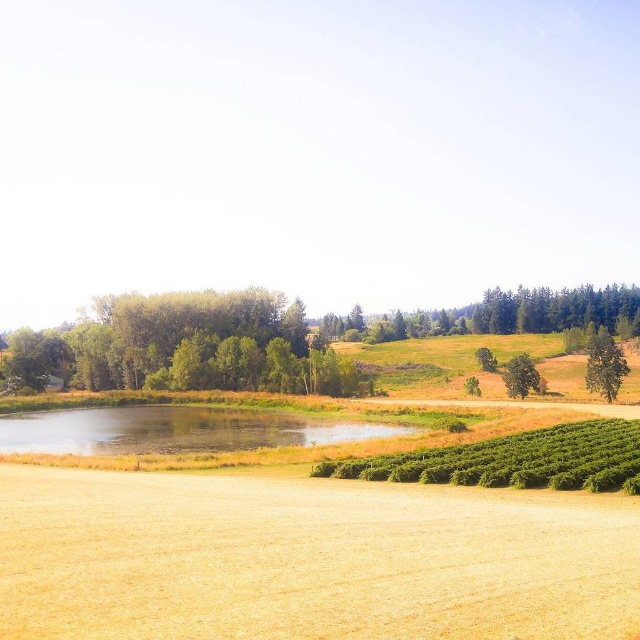
Can you confirm if green leafy trees at left is wider than green textured tree at center?

No.

In the scene shown: Which is more to the left, green leafy trees at left or green textured tree at center?

green leafy trees at left is more to the left.

Which is behind, point (140, 305) or point (604, 307)?

The point (604, 307) is more distant.

The width and height of the screenshot is (640, 640). In order to click on green leafy trees at left in this screenshot , I will do click(192, 346).

Who is taller, golden dry wheat field at lower center or green leafy tree at right?

Standing taller between the two is green leafy tree at right.

Can you confirm if golden dry wheat field at lower center is thinner than green leafy tree at right?

Correct, golden dry wheat field at lower center's width is less than green leafy tree at right's.

Does point (563, 522) lie behind point (592, 356)?

No, (563, 522) is closer to viewer.

The width and height of the screenshot is (640, 640). Identify the location of golden dry wheat field at lower center. (307, 560).

Between green leafy hedge at lower right and green leafy tree at center-right, which one appears on the left side from the viewer's perspective?

From the viewer's perspective, green leafy hedge at lower right appears more on the left side.

Between point (531, 481) and point (502, 378), which one is positioned in front?

Positioned in front is point (531, 481).

Describe the element at coordinates (515, 460) in the screenshot. The image size is (640, 640). I see `green leafy hedge at lower right` at that location.

You are a GUI agent. You are given a task and a screenshot of the screen. Output one action in this format:
    pyautogui.click(x=<x>, y=<y>)
    Task: Click on the green leafy hedge at lower right
    This screenshot has width=640, height=640.
    Given the screenshot: What is the action you would take?
    pyautogui.click(x=515, y=460)